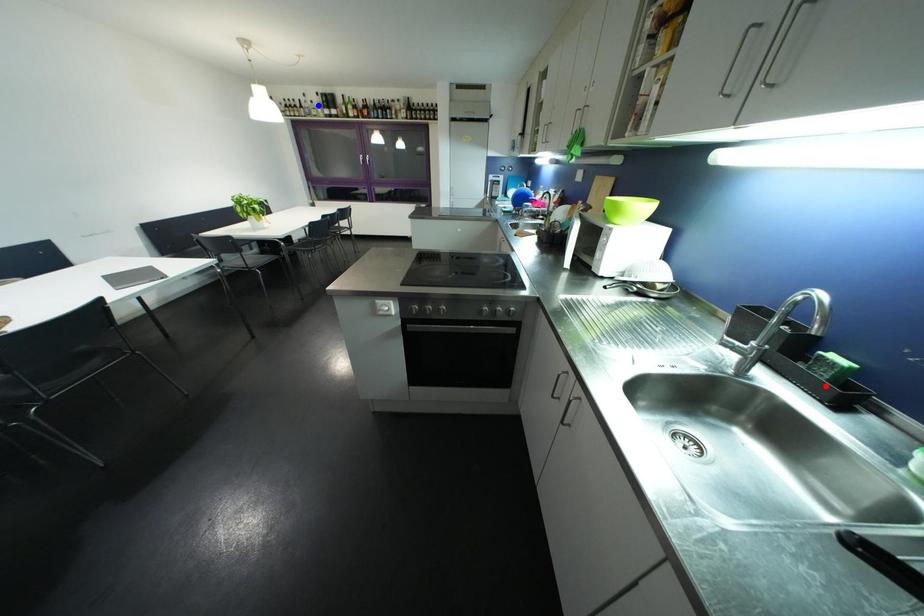
Question: In the image, two points are highlighted. Which point is nearer to the camera? Reply with the corresponding letter.

Choices:
 (A) blue point
 (B) red point

Answer: (B)